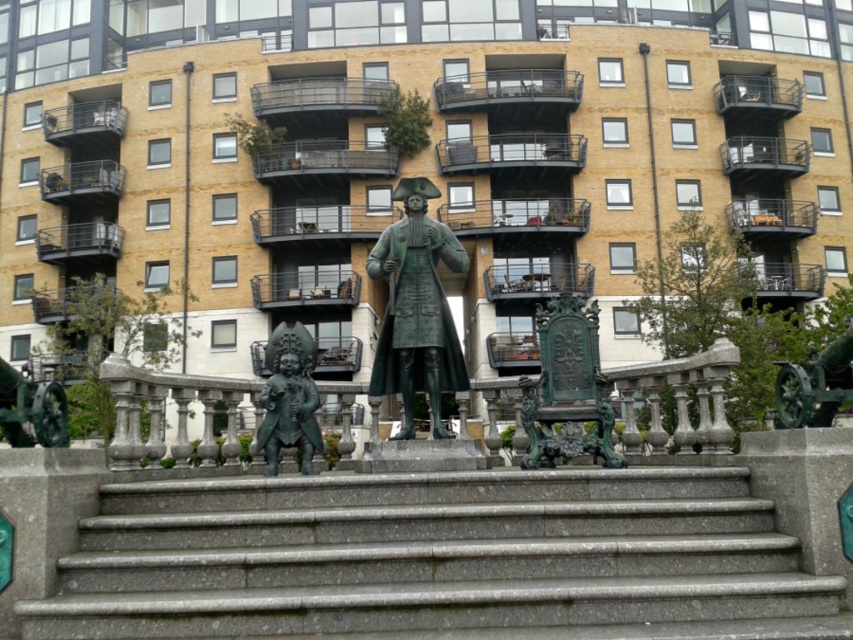
Question: Does gray granite stairs at center appear on the left side of green patinated bronze at center?

Choices:
 (A) no
 (B) yes

Answer: (B)

Question: Which of the following is the farthest from the observer?

Choices:
 (A) (438, 296)
 (B) (258, 499)
 (C) (531, 401)

Answer: (A)

Question: Which point is closer to the camera taking this photo?

Choices:
 (A) (430, 232)
 (B) (288, 364)
 (C) (538, 316)

Answer: (B)

Question: Does gray granite stairs at center appear over green patinated bronze statue at center?

Choices:
 (A) no
 (B) yes

Answer: (A)

Question: Is green patinated bronze statue at center thinner than bronze statue at lower left?

Choices:
 (A) yes
 (B) no

Answer: (A)

Question: Considering the real-world distances, which object is closest to the green patinated bronze statue at center?

Choices:
 (A) gray granite stairs at center
 (B) bronze statue at lower left

Answer: (B)